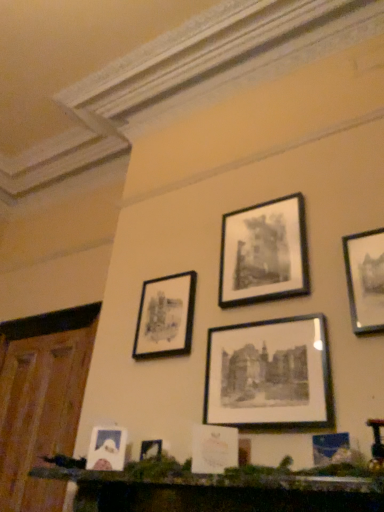
Question: Which direction should I rotate to face matte black picture frame at upper center, the second picture frame viewed from the left, — up or down?

Choices:
 (A) down
 (B) up

Answer: (A)

Question: Is black matte picture frame at upper center, which is the 2th picture frame in right-to-left order, surrounded by wooden mantelpiece at lower center?

Choices:
 (A) yes
 (B) no

Answer: (B)

Question: Is wooden mantelpiece at lower center at the left side of black matte picture frame at upper center, which is the 2th picture frame in right-to-left order?

Choices:
 (A) no
 (B) yes

Answer: (B)

Question: Is wooden mantelpiece at lower center oriented away from black matte picture frame at upper center, placed as the 5th picture frame when sorted from left to right?

Choices:
 (A) yes
 (B) no

Answer: (B)

Question: Is wooden mantelpiece at lower center at the right side of black matte picture frame at upper center, placed as the 5th picture frame when sorted from left to right?

Choices:
 (A) no
 (B) yes

Answer: (A)

Question: From a real-world perspective, is wooden mantelpiece at lower center beneath black matte picture frame at upper center, placed as the 5th picture frame when sorted from left to right?

Choices:
 (A) yes
 (B) no

Answer: (A)

Question: Considering the relative sizes of wooden mantelpiece at lower center and black matte picture frame at upper center, placed as the 5th picture frame when sorted from left to right, in the image provided, is wooden mantelpiece at lower center taller than black matte picture frame at upper center, placed as the 5th picture frame when sorted from left to right,?

Choices:
 (A) yes
 (B) no

Answer: (B)

Question: Is matte white picture frame at center, the third picture frame when ordered from left to right, completely or partially outside of matte black picture frame at upper center, the second picture frame viewed from the left?

Choices:
 (A) yes
 (B) no

Answer: (A)

Question: Is matte white picture frame at center, the fourth picture frame when ordered from right to left, bigger than matte black picture frame at upper center, the second picture frame viewed from the left?

Choices:
 (A) no
 (B) yes

Answer: (A)

Question: Would you say matte white picture frame at center, the third picture frame when ordered from left to right, is a long distance from matte black picture frame at upper center, the second picture frame viewed from the left?

Choices:
 (A) yes
 (B) no

Answer: (B)

Question: Considering the relative sizes of matte white picture frame at center, the fourth picture frame when ordered from right to left, and matte black picture frame at upper center, the 5th picture frame when ordered from right to left, in the image provided, is matte white picture frame at center, the fourth picture frame when ordered from right to left, taller than matte black picture frame at upper center, the 5th picture frame when ordered from right to left,?

Choices:
 (A) no
 (B) yes

Answer: (A)

Question: Is matte white picture frame at center, the third picture frame when ordered from left to right, surrounding matte black picture frame at upper center, the 5th picture frame when ordered from right to left?

Choices:
 (A) no
 (B) yes

Answer: (A)

Question: Is matte white picture frame at center, the fourth picture frame when ordered from right to left, smaller than matte black picture frame at upper center, the 5th picture frame when ordered from right to left?

Choices:
 (A) yes
 (B) no

Answer: (A)

Question: Would you say matte white picture frame at lower left, which is counted as the first picture frame, starting from the left, is outside black matte picture frame at center, the 3th picture frame from the right?

Choices:
 (A) no
 (B) yes

Answer: (B)